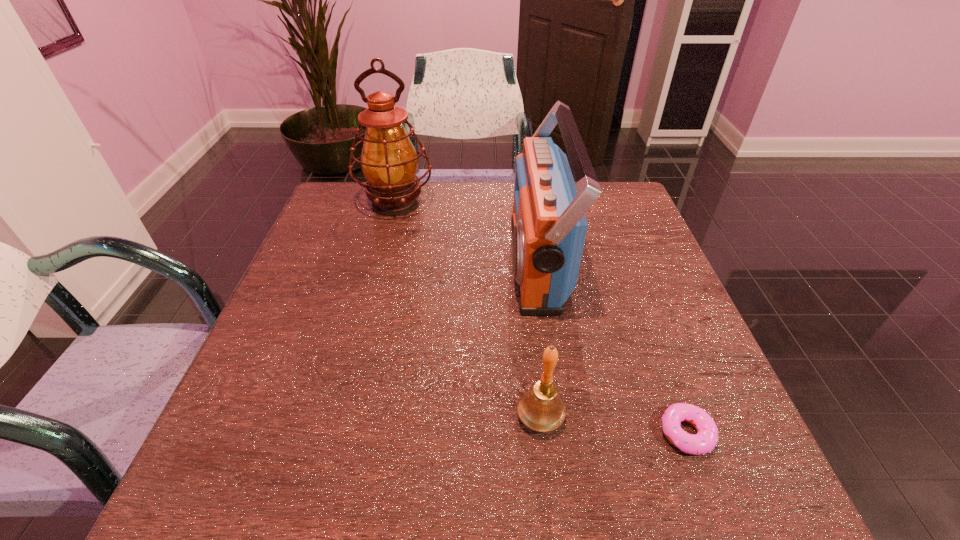
Locate an element on the screen. The width and height of the screenshot is (960, 540). free point located on the left of the bell is located at coordinates (470, 416).

Identify the location of blank area located on the left of the shortest object. (571, 433).

The width and height of the screenshot is (960, 540). I want to click on oil lamp present at the far edge, so click(389, 161).

You are a GUI agent. You are given a task and a screenshot of the screen. Output one action in this format:
    pyautogui.click(x=<x>, y=<y>)
    Task: Click on the radio receiver located in the far edge section of the desktop
    The width and height of the screenshot is (960, 540).
    Given the screenshot: What is the action you would take?
    pyautogui.click(x=549, y=226)

In order to click on object at the near edge in this screenshot , I will do `click(706, 439)`.

What are the coordinates of `object situated at the left edge` in the screenshot? It's located at (389, 161).

What are the coordinates of `object that is at the right edge` in the screenshot? It's located at (706, 439).

I want to click on object positioned at the far left corner, so click(x=389, y=161).

Where is `object present at the near right corner`? This screenshot has height=540, width=960. object present at the near right corner is located at coordinates (706, 439).

I want to click on vacant space at the far edge, so (482, 227).